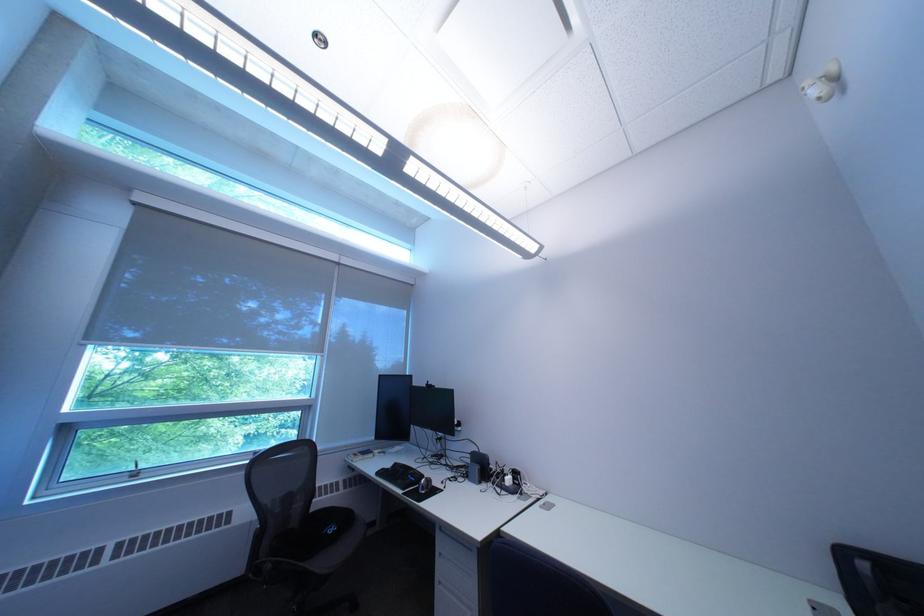
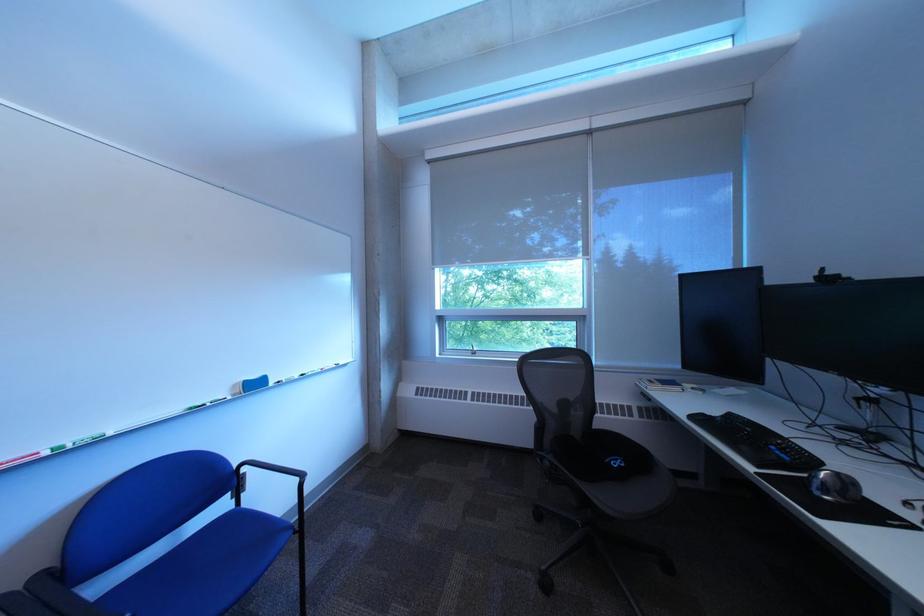
Where in the second image is the point corresponding to the point at 285,568 from the first image?

(563, 464)